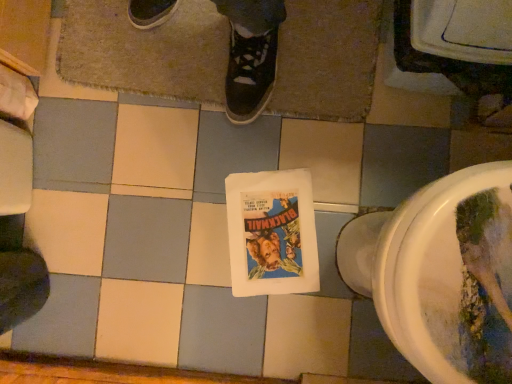
This screenshot has width=512, height=384. I want to click on vacant space situated on the left part of white glossy toilet at lower right, so click(x=273, y=283).